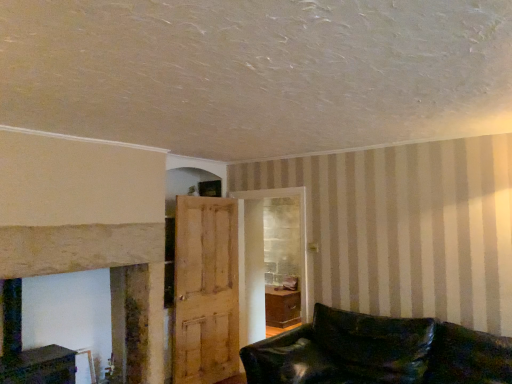
What do you see at coordinates (111, 281) in the screenshot? I see `smooth stone fireplace at left` at bounding box center [111, 281].

The height and width of the screenshot is (384, 512). Find the location of `light brown wooden door at center`. light brown wooden door at center is located at coordinates (205, 291).

Is point (24, 257) behind point (223, 295)?

No, (24, 257) is closer to viewer.

Is light brown wooden door at center completely or partially inside smooth stone fireplace at left?

No, smooth stone fireplace at left does not contain light brown wooden door at center.

Does smooth stone fireplace at left appear on the right side of light brown wooden door at center?

In fact, smooth stone fireplace at left is to the left of light brown wooden door at center.

How far apart are leather couch at lower right and light brown wooden door at center?

leather couch at lower right and light brown wooden door at center are 4.87 feet apart.

Could you tell me if leather couch at lower right is facing light brown wooden door at center?

No, leather couch at lower right is not aimed at light brown wooden door at center.

Would you say leather couch at lower right is outside light brown wooden door at center?

Absolutely, leather couch at lower right is external to light brown wooden door at center.

From the picture: From a real-world perspective, is light brown wooden door at center positioned over smooth stone fireplace at left based on gravity?

Actually, light brown wooden door at center is physically below smooth stone fireplace at left in the real world.

Is light brown wooden door at center in front of smooth stone fireplace at left?

No, it is not.

Is light brown wooden door at center next to smooth stone fireplace at left and touching it?

No, light brown wooden door at center is not touching smooth stone fireplace at left.

Is smooth stone fireplace at left located within light brown wooden door at center?

No, smooth stone fireplace at left is located outside of light brown wooden door at center.

Between point (230, 363) and point (322, 358), which one is positioned behind?

Point (230, 363)

Locate an element on the screen. This screenshot has width=512, height=384. door located on the left of leather couch at lower right is located at coordinates (205, 291).

Is light brown wooden door at center not inside leather couch at lower right?

Indeed, light brown wooden door at center is completely outside leather couch at lower right.

Is smooth stone fireplace at left placed right next to leather couch at lower right?

No.

Does smooth stone fireplace at left appear on the right side of leather couch at lower right?

Incorrect, smooth stone fireplace at left is not on the right side of leather couch at lower right.

What's the angular difference between smooth stone fireplace at left and leather couch at lower right's facing directions?

They differ by 87.9 degrees in their facing directions.

Which object is closer to the camera, smooth stone fireplace at left or leather couch at lower right?

leather couch at lower right.

Is leather couch at lower right bigger or smaller than smooth stone fireplace at left?

In the image, leather couch at lower right appears to be smaller than smooth stone fireplace at left.

Is leather couch at lower right not close to smooth stone fireplace at left?

leather couch at lower right is positioned a significant distance from smooth stone fireplace at left.

Between leather couch at lower right and smooth stone fireplace at left, which one is positioned in front?

leather couch at lower right is closer to the camera.

The width and height of the screenshot is (512, 384). Identify the location of fireplace in front of the light brown wooden door at center. (111, 281).

In the image, there is a light brown wooden door at center. Where is `studio couch below it (from a real-world perspective)`? studio couch below it (from a real-world perspective) is located at coordinates (378, 352).

Looking at the image, which one is located closer to smooth stone fireplace at left, leather couch at lower right or light brown wooden door at center?

light brown wooden door at center.

From the image, which object appears to be nearer to light brown wooden door at center, leather couch at lower right or smooth stone fireplace at left?

smooth stone fireplace at left is closer to light brown wooden door at center.

When comparing their distances from light brown wooden door at center, does smooth stone fireplace at left or leather couch at lower right seem further?

Based on the image, leather couch at lower right appears to be further to light brown wooden door at center.

Estimate the real-world distances between objects in this image. Which object is further from smooth stone fireplace at left, light brown wooden door at center or leather couch at lower right?

Among the two, leather couch at lower right is located further to smooth stone fireplace at left.

Based on their spatial positions, is smooth stone fireplace at left or light brown wooden door at center closer to leather couch at lower right?

light brown wooden door at center is positioned closer to the anchor leather couch at lower right.

Which object lies further to the anchor point leather couch at lower right, light brown wooden door at center or smooth stone fireplace at left?

smooth stone fireplace at left is further to leather couch at lower right.

Identify the location of door located between smooth stone fireplace at left and leather couch at lower right in the left-right direction. The height and width of the screenshot is (384, 512). (205, 291).